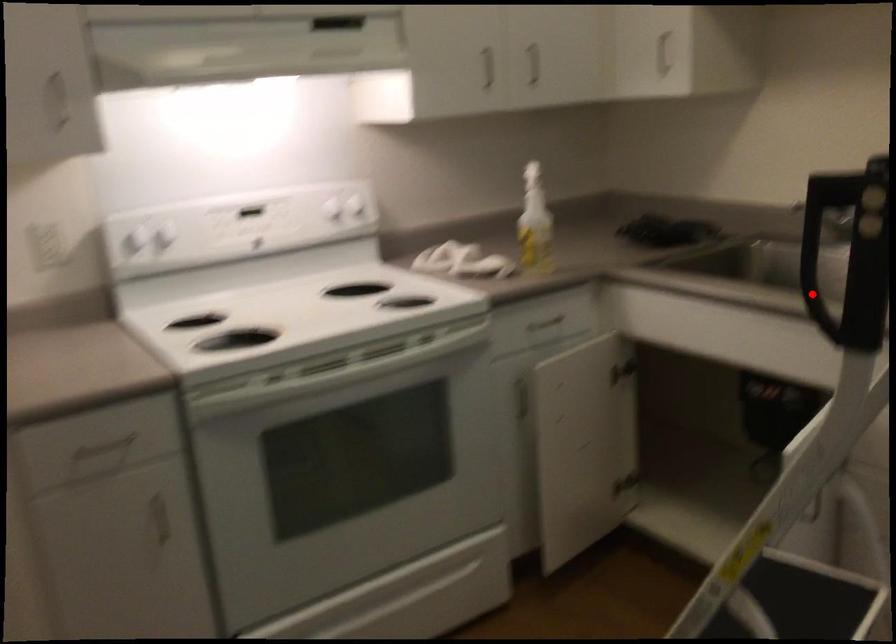
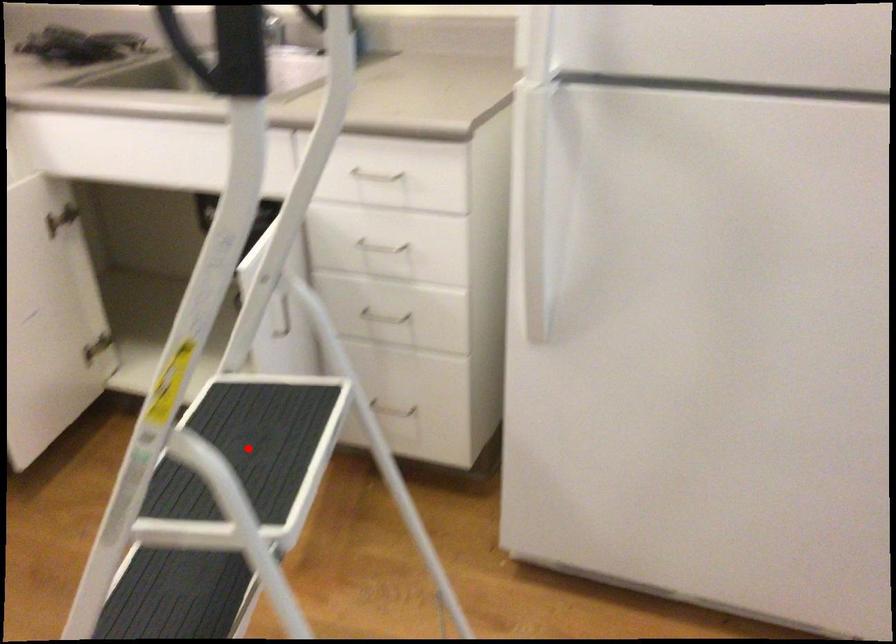
I am providing you with two images of the same scene from different viewpoints. A red point is marked on the first image and another point is marked on the second image. Does the point marked in image1 correspond to the same location as the one in image2?

No